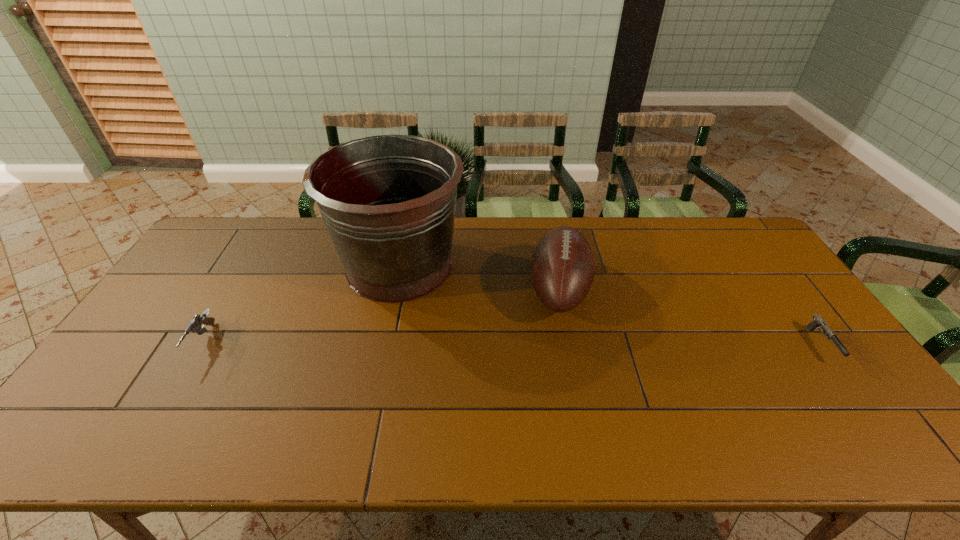
Identify the location of free space located at the barrel of the leftmost object. (171, 395).

Where is `blank space located 0.160m at the muzzle end of the shortest object`? The width and height of the screenshot is (960, 540). blank space located 0.160m at the muzzle end of the shortest object is located at coordinates (x=879, y=423).

Identify the location of bucket present at the far edge. The height and width of the screenshot is (540, 960). (388, 201).

Image resolution: width=960 pixels, height=540 pixels. Find the location of `football (American) at the far edge`. football (American) at the far edge is located at coordinates (562, 268).

You are a GUI agent. You are given a task and a screenshot of the screen. Output one action in this format:
    pyautogui.click(x=<x>, y=<y>)
    Task: Click on the object located at the right edge
    
    Given the screenshot: What is the action you would take?
    pyautogui.click(x=818, y=321)

Where is `free space at the far edge of the desktop`? free space at the far edge of the desktop is located at coordinates 276,239.

Image resolution: width=960 pixels, height=540 pixels. In the image, there is a desktop. Identify the location of free region at the near edge. (237, 440).

Where is `vacant space at the left edge of the desktop`? vacant space at the left edge of the desktop is located at coordinates (145, 336).

Locate an element on the screen. The height and width of the screenshot is (540, 960). vacant space at the right edge of the desktop is located at coordinates (751, 271).

I want to click on free space that is in between the bucket and the shorter gun, so click(x=611, y=305).